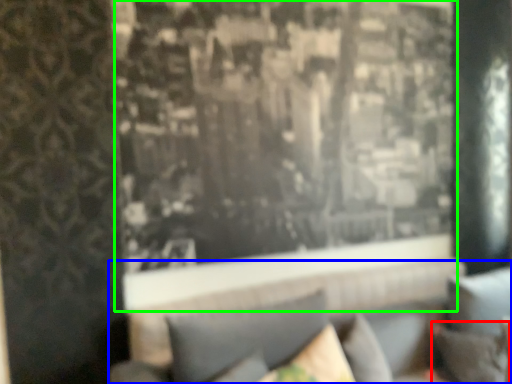
Question: Which is farther away from pillow (highlighted by a red box)? couch (highlighted by a blue box) or window (highlighted by a green box)?

Choices:
 (A) couch
 (B) window

Answer: (B)